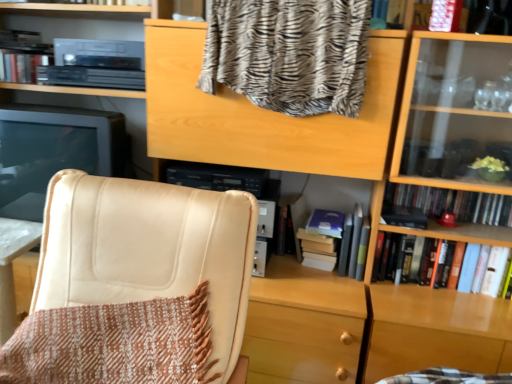
Question: Is point pyautogui.click(x=178, y=286) positioned closer to the camera than point pyautogui.click(x=117, y=329)?

Choices:
 (A) farther
 (B) closer

Answer: (B)

Question: From the image's perspective, is beige leather chair at left above or below brown woven blanket at lower left, which appears as the 1th blanket when ordered from the bottom?

Choices:
 (A) below
 (B) above

Answer: (B)

Question: Which of these objects is positioned closest to the beige leather chair at left?

Choices:
 (A) zebra-patterned fabric at upper center, which is the 1th blanket in top-to-bottom order
 (B) brown woven blanket at lower left, the 2th blanket in the top-to-bottom sequence
 (C) satin black monitor at left
 (D) gray matte book at center, the 3th book in the right-to-left sequence
 (E) hardcover book at right, which ranks as the first book in right-to-left order

Answer: (B)

Question: Which object is the farthest from the zebra-patterned fabric at upper center, which is the 1th blanket in top-to-bottom order?

Choices:
 (A) satin black monitor at left
 (B) beige leather chair at left
 (C) brown woven blanket at lower left, the 2th blanket in the top-to-bottom sequence
 (D) hardcover book at right, which ranks as the first book in right-to-left order
 (E) hardcover book at right, which is the first book from bottom to top

Answer: (C)